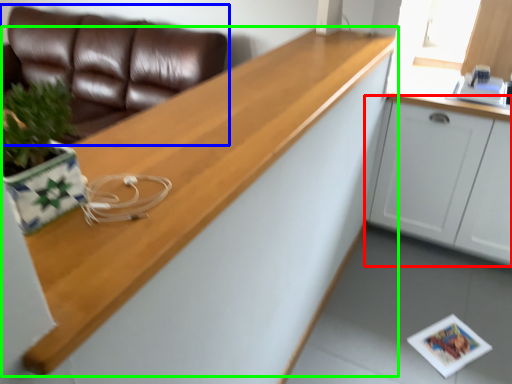
Question: Which is farther away from cabinetry (highlighted by a red box)? studio couch (highlighted by a blue box) or countertop (highlighted by a green box)?

Choices:
 (A) studio couch
 (B) countertop

Answer: (A)